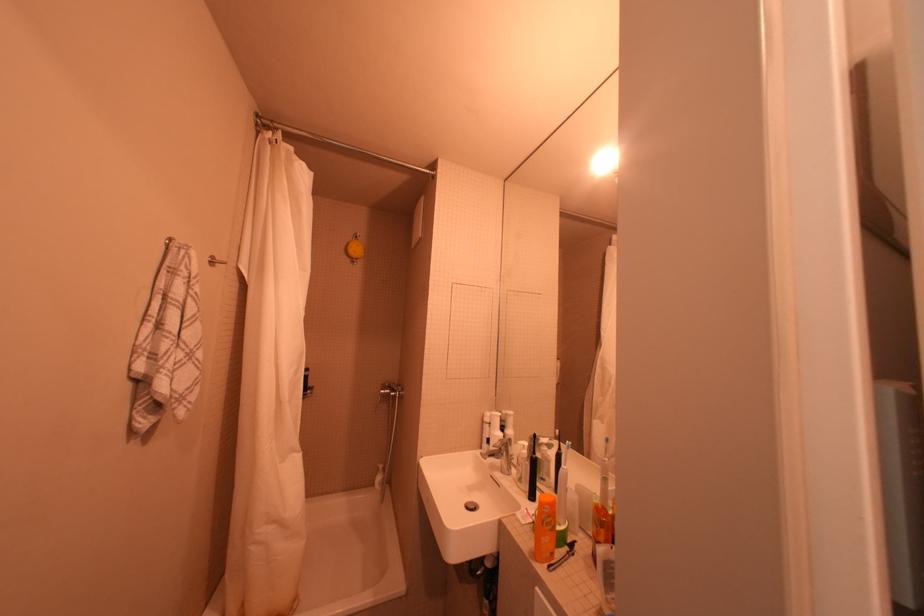
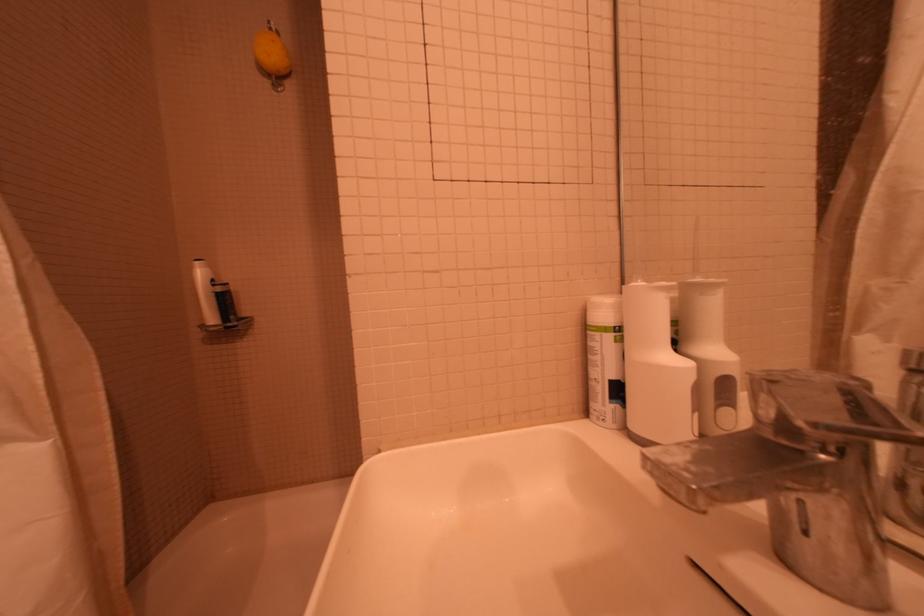
Locate, in the second image, the point that corresponds to (x=499, y=419) in the first image.

(627, 309)